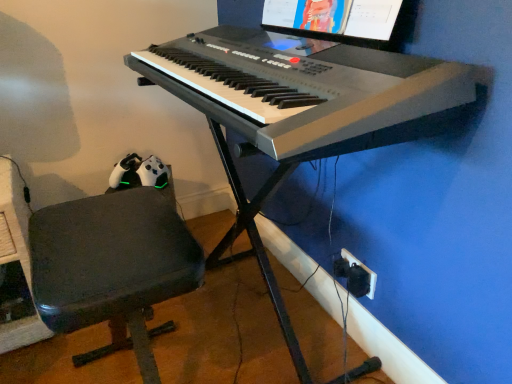
Question: Considering the relative sizes of dark gray fabric chair at lower left and matte black monitor at upper center in the image provided, is dark gray fabric chair at lower left bigger than matte black monitor at upper center?

Choices:
 (A) yes
 (B) no

Answer: (A)

Question: Considering the relative sizes of dark gray fabric chair at lower left and matte black monitor at upper center in the image provided, is dark gray fabric chair at lower left shorter than matte black monitor at upper center?

Choices:
 (A) yes
 (B) no

Answer: (B)

Question: Is dark gray fabric chair at lower left not within matte black monitor at upper center?

Choices:
 (A) yes
 (B) no

Answer: (A)

Question: Is dark gray fabric chair at lower left wider than matte black monitor at upper center?

Choices:
 (A) yes
 (B) no

Answer: (A)

Question: Can you confirm if dark gray fabric chair at lower left is smaller than matte black monitor at upper center?

Choices:
 (A) no
 (B) yes

Answer: (A)

Question: From a real-world perspective, is dark gray fabric chair at lower left below matte black monitor at upper center?

Choices:
 (A) no
 (B) yes

Answer: (B)

Question: Does matte black monitor at upper center lie in front of dark gray fabric chair at lower left?

Choices:
 (A) yes
 (B) no

Answer: (B)

Question: Does matte black monitor at upper center have a smaller size compared to dark gray fabric chair at lower left?

Choices:
 (A) no
 (B) yes

Answer: (B)

Question: Is matte black monitor at upper center taller than dark gray fabric chair at lower left?

Choices:
 (A) yes
 (B) no

Answer: (B)

Question: Is matte black monitor at upper center thinner than dark gray fabric chair at lower left?

Choices:
 (A) yes
 (B) no

Answer: (A)

Question: From the image's perspective, is matte black monitor at upper center above dark gray fabric chair at lower left?

Choices:
 (A) no
 (B) yes

Answer: (B)

Question: Does matte black monitor at upper center appear on the right side of dark gray fabric chair at lower left?

Choices:
 (A) yes
 (B) no

Answer: (A)

Question: Is dark gray fabric chair at lower left to the right of white plastic keyboard at center from the viewer's perspective?

Choices:
 (A) no
 (B) yes

Answer: (A)